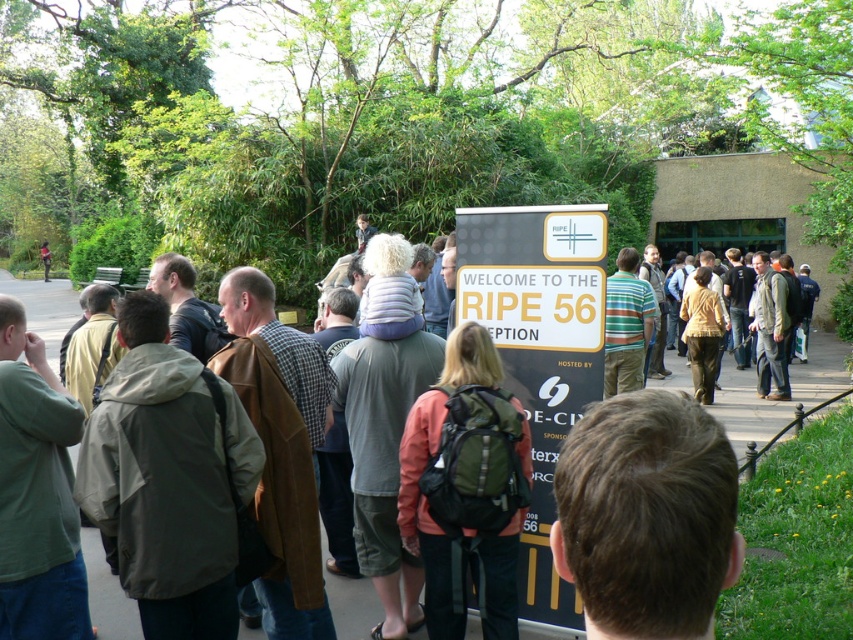
You are a photographer standing at a distance of 3.63 feet from the brown hair at center. You want to capture a clear photo of the signboard behind them. Will you need to adjust your position to avoid the person blocking the signboard?

The brown hair at center is 3.63 feet away from the viewer. Since the distance is exactly the same as your current position, you are already at the correct distance to potentially frame the shot. However, whether the person is blocking the signboard depends on their height and the angle. Without additional information about their height or the signboard placement, it is uncertain if adjustment is needed.